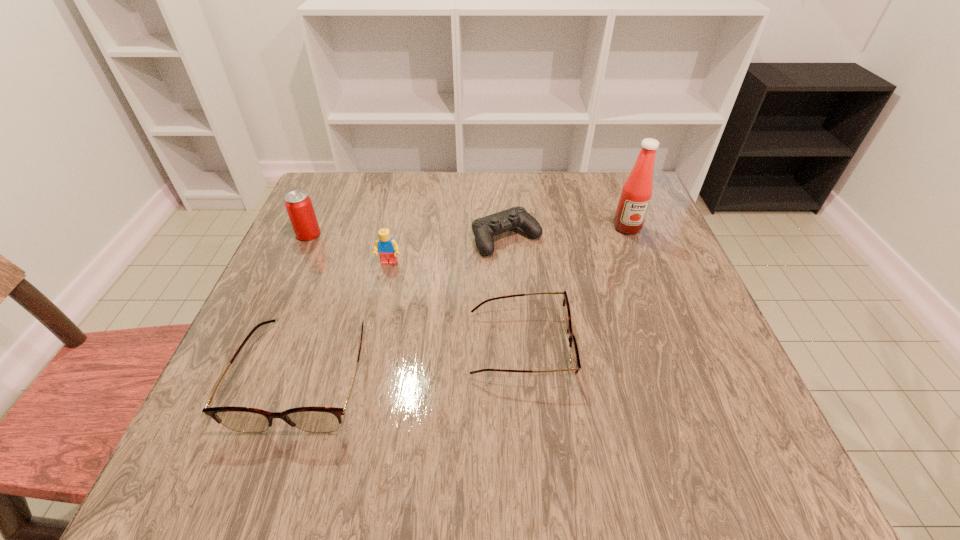
The height and width of the screenshot is (540, 960). I want to click on vacant place for an extra spectacles on the right, so click(x=711, y=321).